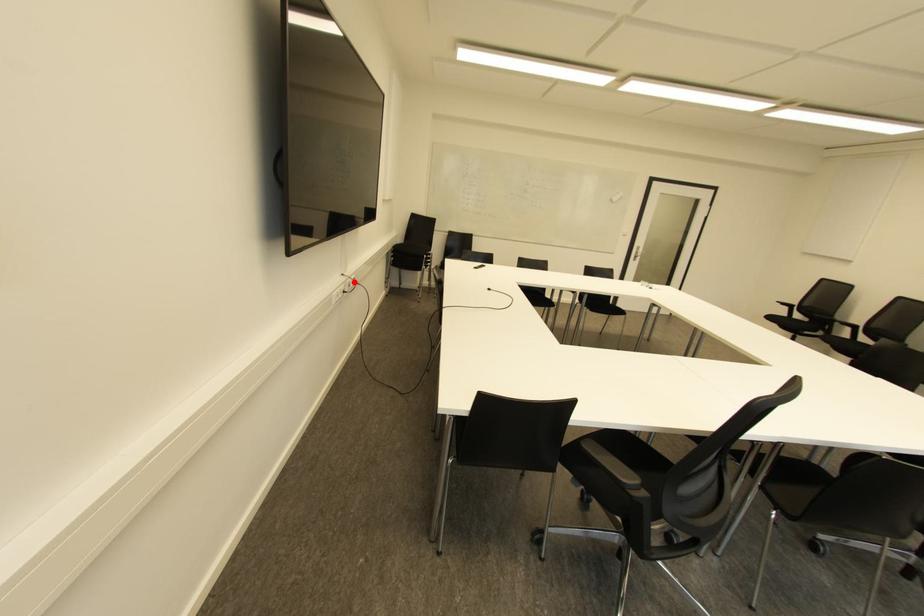
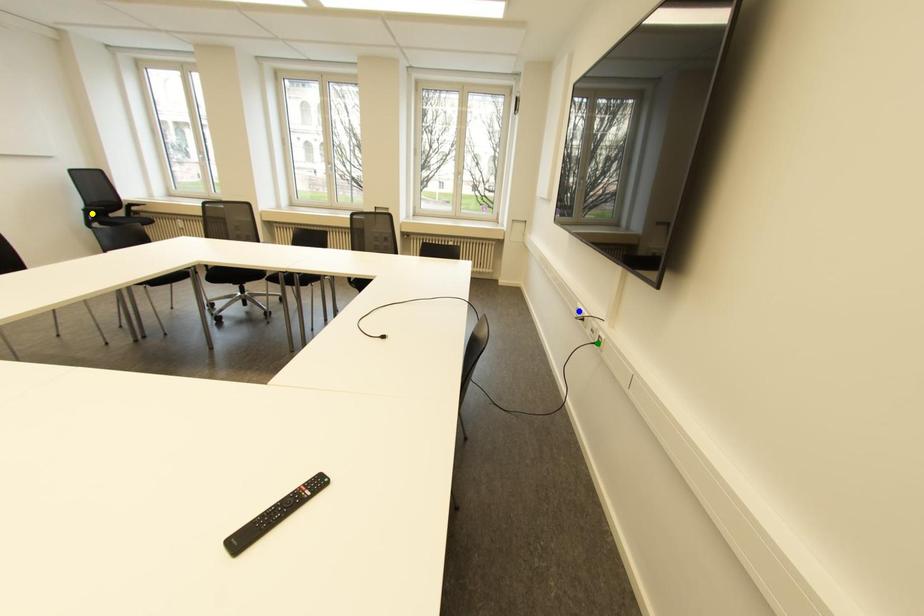
Question: I am providing you with two images of the same scene from different viewpoints. A red point is marked on the first image. You are given multiple points on the second image. Which mark in image 2 goes with the point in image 1?

Choices:
 (A) green point
 (B) blue point
 (C) yellow point

Answer: (A)